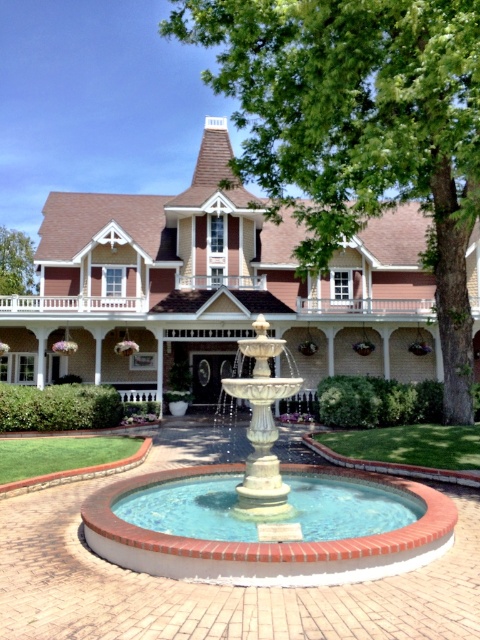
Does green leafy tree at center have a lesser height compared to green leafy tree at upper center?

Incorrect, green leafy tree at center's height does not fall short of green leafy tree at upper center's.

Is point (284, 148) farther from camera compared to point (6, 244)?

No, it is not.

Identify the location of green leafy tree at center. [x=359, y=129].

The width and height of the screenshot is (480, 640). What are the coordinates of `green leafy tree at center` in the screenshot? It's located at (359, 129).

Between green leafy tree at center and white stone fountain at center, which one appears on the right side from the viewer's perspective?

green leafy tree at center

The height and width of the screenshot is (640, 480). Find the location of `green leafy tree at center`. green leafy tree at center is located at coordinates (359, 129).

At what (x,y) coordinates should I click in order to perform the action: click on green leafy tree at center. Please return your answer as a coordinate pair (x, y). This screenshot has width=480, height=640. Looking at the image, I should click on (359, 129).

Which of these two, white stone fountain at center or white painted wood porch at upper center, stands taller?

Standing taller between the two is white painted wood porch at upper center.

Does white stone fountain at center appear on the left side of white painted wood porch at upper center?

Yes, white stone fountain at center is to the left of white painted wood porch at upper center.

Does point (192, 556) come behind point (176, 308)?

That is False.

Identify the location of white stone fountain at center. The height and width of the screenshot is (640, 480). (267, 509).